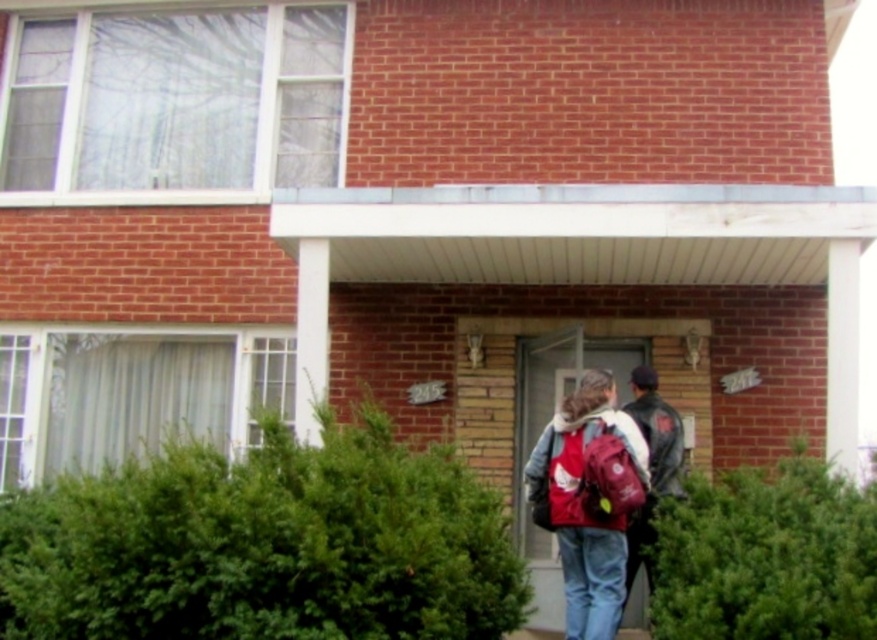
Who is lower down, green leafy hedge at center or leather jacket at center?

leather jacket at center is below.

What do you see at coordinates (265, 545) in the screenshot? This screenshot has width=877, height=640. I see `green leafy hedge at center` at bounding box center [265, 545].

This screenshot has width=877, height=640. Describe the element at coordinates (265, 545) in the screenshot. I see `green leafy hedge at center` at that location.

Identify the location of green leafy hedge at center. (265, 545).

Describe the element at coordinates (265, 545) in the screenshot. I see `green leafy hedge at center` at that location.

Does green leafy hedge at center have a larger size compared to green leafy hedge at lower right?

Correct, green leafy hedge at center is larger in size than green leafy hedge at lower right.

Is point (273, 419) behind point (703, 609)?

Yes, point (273, 419) is farther from viewer.

You are a GUI agent. You are given a task and a screenshot of the screen. Output one action in this format:
    pyautogui.click(x=<x>, y=<y>)
    Task: Click on the green leafy hedge at center
    The width and height of the screenshot is (877, 640).
    Given the screenshot: What is the action you would take?
    pyautogui.click(x=265, y=545)

Which is more to the left, green leafy hedge at lower right or leather jacket at center?

Positioned to the left is leather jacket at center.

Is green leafy hedge at lower right to the right of leather jacket at center from the viewer's perspective?

Indeed, green leafy hedge at lower right is positioned on the right side of leather jacket at center.

Where is `green leafy hedge at lower right`? The width and height of the screenshot is (877, 640). green leafy hedge at lower right is located at coordinates (766, 556).